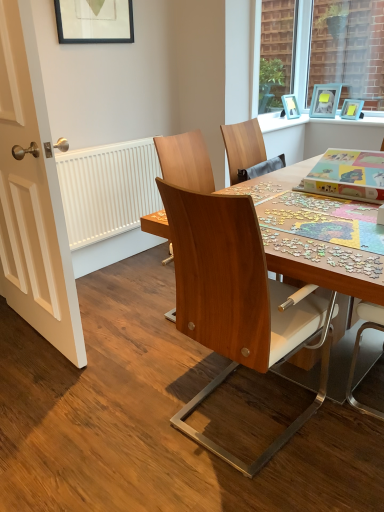
Image resolution: width=384 pixels, height=512 pixels. In order to click on vacant area that lies between white painted wood door at left and white matte radiator at left in this screenshot , I will do `click(116, 292)`.